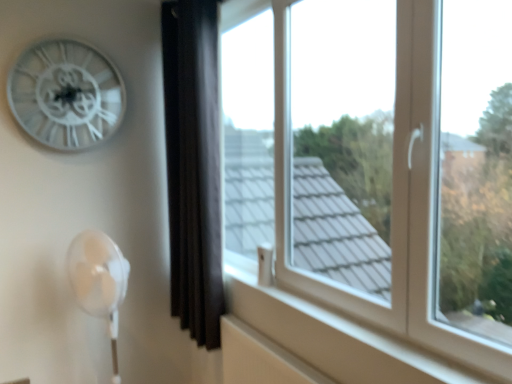
Question: Is white metallic clock at upper left directly adjacent to black velvet curtain at center?

Choices:
 (A) no
 (B) yes

Answer: (A)

Question: Is white metallic clock at upper left facing away from black velvet curtain at center?

Choices:
 (A) no
 (B) yes

Answer: (A)

Question: Is white metallic clock at upper left facing towards black velvet curtain at center?

Choices:
 (A) yes
 (B) no

Answer: (B)

Question: From a real-world perspective, is white metallic clock at upper left below black velvet curtain at center?

Choices:
 (A) yes
 (B) no

Answer: (B)

Question: From the image's perspective, is white metallic clock at upper left on top of black velvet curtain at center?

Choices:
 (A) no
 (B) yes

Answer: (B)

Question: Does white metallic clock at upper left appear on the right side of black velvet curtain at center?

Choices:
 (A) no
 (B) yes

Answer: (A)

Question: Is black velvet curtain at center at the right side of white metallic clock at upper left?

Choices:
 (A) yes
 (B) no

Answer: (A)

Question: Is black velvet curtain at center directly adjacent to white metallic clock at upper left?

Choices:
 (A) yes
 (B) no

Answer: (B)

Question: Considering the relative sizes of black velvet curtain at center and white metallic clock at upper left in the image provided, is black velvet curtain at center thinner than white metallic clock at upper left?

Choices:
 (A) yes
 (B) no

Answer: (B)

Question: Is black velvet curtain at center outside of white metallic clock at upper left?

Choices:
 (A) yes
 (B) no

Answer: (A)

Question: Would you say black velvet curtain at center contains white metallic clock at upper left?

Choices:
 (A) no
 (B) yes

Answer: (A)

Question: From the image's perspective, does black velvet curtain at center appear lower than white metallic clock at upper left?

Choices:
 (A) yes
 (B) no

Answer: (A)

Question: Would you consider transparent glass window at center to be distant from white metallic clock at upper left?

Choices:
 (A) no
 (B) yes

Answer: (A)